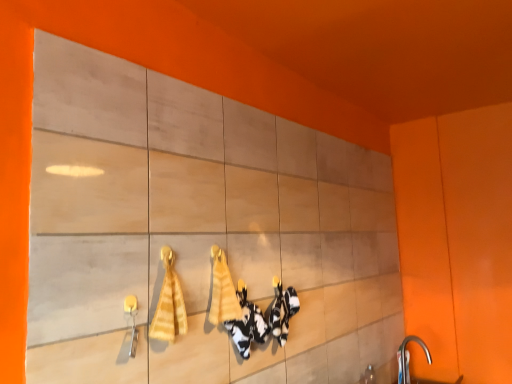
Question: Is yellow striped towel at center, arranged as the 1th bath towel when viewed from the left, thinner than yellow fabric bath towel at center, the first bath towel from the right?

Choices:
 (A) no
 (B) yes

Answer: (A)

Question: Does yellow striped towel at center, which is counted as the second bath towel, starting from the back, appear on the right side of yellow fabric bath towel at center, the first bath towel from the right?

Choices:
 (A) no
 (B) yes

Answer: (A)

Question: Considering the relative sizes of yellow striped towel at center, arranged as the 1th bath towel when viewed from the left, and yellow fabric bath towel at center, the first bath towel from the right, in the image provided, is yellow striped towel at center, arranged as the 1th bath towel when viewed from the left, shorter than yellow fabric bath towel at center, the first bath towel from the right,?

Choices:
 (A) yes
 (B) no

Answer: (B)

Question: Is the position of yellow striped towel at center, which ranks as the first bath towel in front-to-back order, more distant than that of yellow fabric bath towel at center, the 1th bath towel from the back?

Choices:
 (A) no
 (B) yes

Answer: (A)

Question: Considering the relative sizes of yellow striped towel at center, arranged as the 2th bath towel when viewed from the right, and yellow fabric bath towel at center, the second bath towel in the front-to-back sequence, in the image provided, is yellow striped towel at center, arranged as the 2th bath towel when viewed from the right, bigger than yellow fabric bath towel at center, the second bath towel in the front-to-back sequence,?

Choices:
 (A) yes
 (B) no

Answer: (A)

Question: From a real-world perspective, relative to silver metallic faucet at lower right, is yellow striped towel at center, which ranks as the first bath towel in front-to-back order, vertically above or below?

Choices:
 (A) below
 (B) above

Answer: (B)

Question: Considering the relative positions of yellow striped towel at center, arranged as the 1th bath towel when viewed from the left, and silver metallic faucet at lower right in the image provided, is yellow striped towel at center, arranged as the 1th bath towel when viewed from the left, to the left or to the right of silver metallic faucet at lower right?

Choices:
 (A) right
 (B) left

Answer: (B)

Question: Is point (182, 317) positioned closer to the camera than point (399, 380)?

Choices:
 (A) farther
 (B) closer

Answer: (B)

Question: Is yellow striped towel at center, which ranks as the first bath towel in front-to-back order, bigger or smaller than silver metallic faucet at lower right?

Choices:
 (A) big
 (B) small

Answer: (B)

Question: Considering the positions of point (163, 304) and point (224, 312), is point (163, 304) closer or farther from the camera than point (224, 312)?

Choices:
 (A) farther
 (B) closer

Answer: (B)

Question: Considering the positions of yellow striped towel at center, which is counted as the second bath towel, starting from the back, and yellow fabric bath towel at center, the 1th bath towel from the back, in the image, is yellow striped towel at center, which is counted as the second bath towel, starting from the back, wider or thinner than yellow fabric bath towel at center, the 1th bath towel from the back,?

Choices:
 (A) wide
 (B) thin

Answer: (A)

Question: In terms of height, does yellow striped towel at center, arranged as the 1th bath towel when viewed from the left, look taller or shorter compared to yellow fabric bath towel at center, the first bath towel from the right?

Choices:
 (A) short
 (B) tall

Answer: (B)

Question: Is yellow striped towel at center, arranged as the 1th bath towel when viewed from the left, to the left or to the right of yellow fabric bath towel at center, the first bath towel from the right, in the image?

Choices:
 (A) left
 (B) right

Answer: (A)

Question: Looking at the image, does silver metallic faucet at lower right seem bigger or smaller compared to yellow striped towel at center, arranged as the 2th bath towel when viewed from the right?

Choices:
 (A) small
 (B) big

Answer: (B)

Question: Choose the correct answer: Is silver metallic faucet at lower right inside yellow striped towel at center, which ranks as the first bath towel in front-to-back order, or outside it?

Choices:
 (A) outside
 (B) inside

Answer: (A)